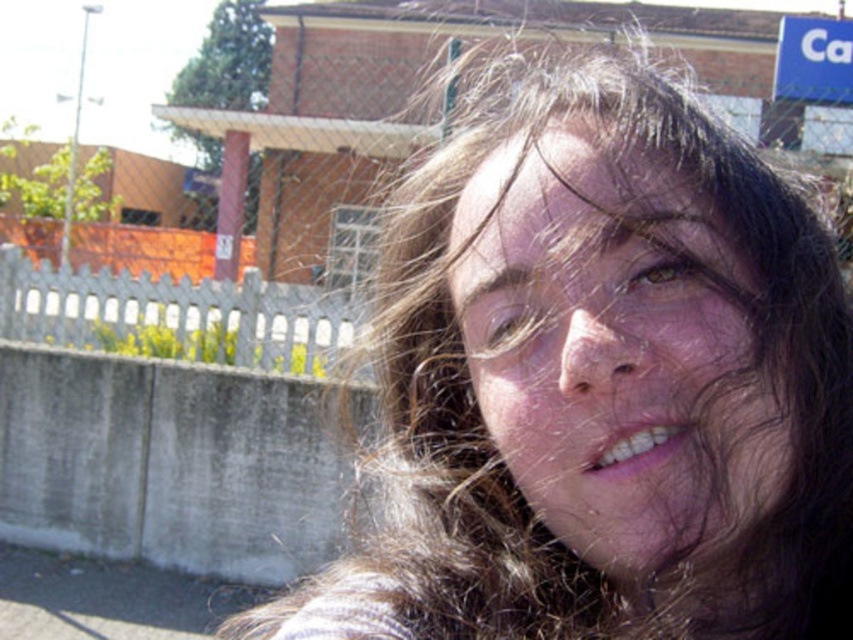
Can you confirm if brown hair at center is wider than blue plastic sign at upper right?

No.

What are the coordinates of `brown hair at center` in the screenshot? It's located at (601, 381).

You are a GUI agent. You are given a task and a screenshot of the screen. Output one action in this format:
    pyautogui.click(x=<x>, y=<y>)
    Task: Click on the brown hair at center
    This screenshot has width=853, height=640.
    Given the screenshot: What is the action you would take?
    pyautogui.click(x=601, y=381)

The width and height of the screenshot is (853, 640). In order to click on smooth skin face at center in this screenshot , I will do `click(616, 349)`.

Can you confirm if smooth skin face at center is smaller than blue plastic sign at upper right?

Correct, smooth skin face at center occupies less space than blue plastic sign at upper right.

Describe the element at coordinates (616, 349) in the screenshot. The height and width of the screenshot is (640, 853). I see `smooth skin face at center` at that location.

Locate an element on the screen. The height and width of the screenshot is (640, 853). smooth skin face at center is located at coordinates (616, 349).

This screenshot has height=640, width=853. Describe the element at coordinates (601, 381) in the screenshot. I see `brown hair at center` at that location.

Between brown hair at center and smooth skin face at center, which one has more height?

With more height is brown hair at center.

Locate an element on the screen. brown hair at center is located at coordinates (601, 381).